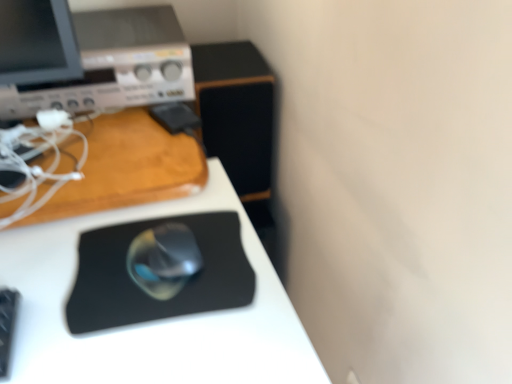
This screenshot has width=512, height=384. I want to click on empty space that is ontop of black matte mouse pad at center (from a real-world perspective), so click(x=124, y=259).